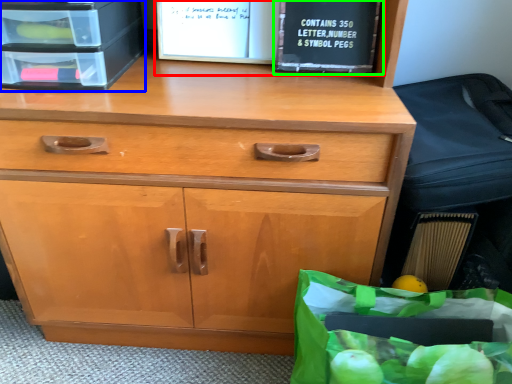
Question: Considering the real-world distances, which object is farthest from book (highlighted by a red box)? crate (highlighted by a blue box) or paperback book (highlighted by a green box)?

Choices:
 (A) crate
 (B) paperback book

Answer: (A)